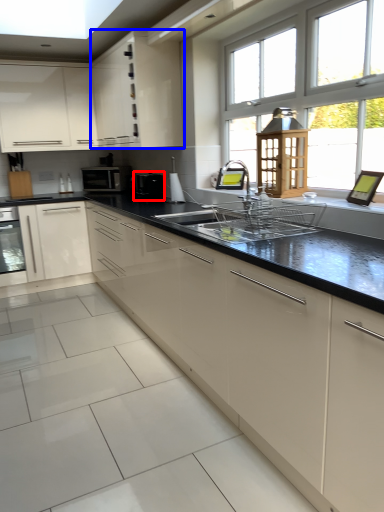
Question: Which object is further to the camera taking this photo, appliance (highlighted by a red box) or cabinetry (highlighted by a blue box)?

Choices:
 (A) appliance
 (B) cabinetry

Answer: (A)